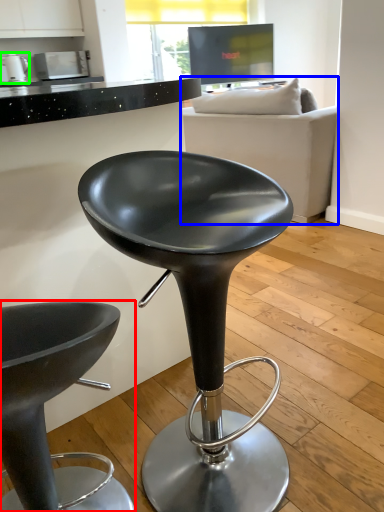
Question: Which is farther away from chair (highlighted by a red box)? studio couch (highlighted by a blue box) or appliance (highlighted by a green box)?

Choices:
 (A) studio couch
 (B) appliance

Answer: (B)